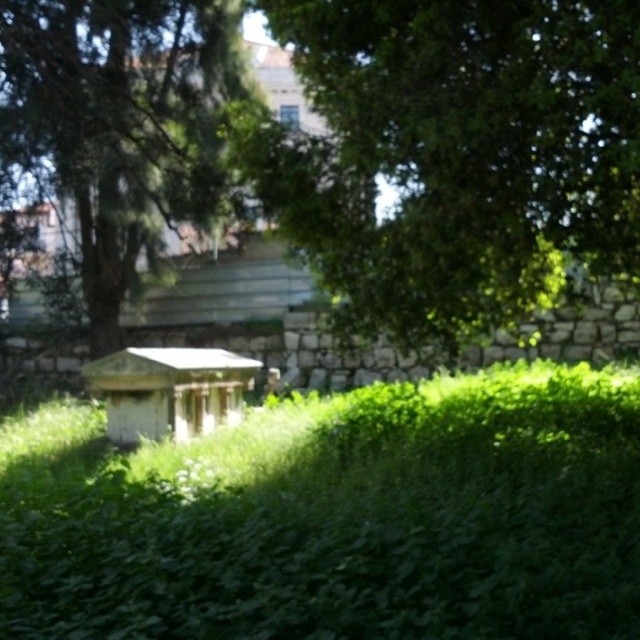
Can you confirm if green leafy tree at upper center is bigger than white wood gazebo at center?

Indeed, green leafy tree at upper center has a larger size compared to white wood gazebo at center.

Is point (484, 220) closer to camera compared to point (125, 442)?

Yes, point (484, 220) is closer to viewer.

I want to click on green leafy tree at upper center, so click(x=464, y=150).

Does green leafy tree at upper center have a smaller size compared to green leafy tree at center?

Indeed, green leafy tree at upper center has a smaller size compared to green leafy tree at center.

Identify the location of green leafy tree at upper center. This screenshot has width=640, height=640. (464, 150).

Where is `green leafy tree at upper center`? green leafy tree at upper center is located at coordinates (464, 150).

Is point (518, 550) more distant than point (188, 129)?

No, it is not.

Does point (417, 611) come closer to viewer compared to point (20, 131)?

Yes, it is in front of point (20, 131).

This screenshot has height=640, width=640. Find the location of `green leafy grass at center`. green leafy grass at center is located at coordinates (337, 515).